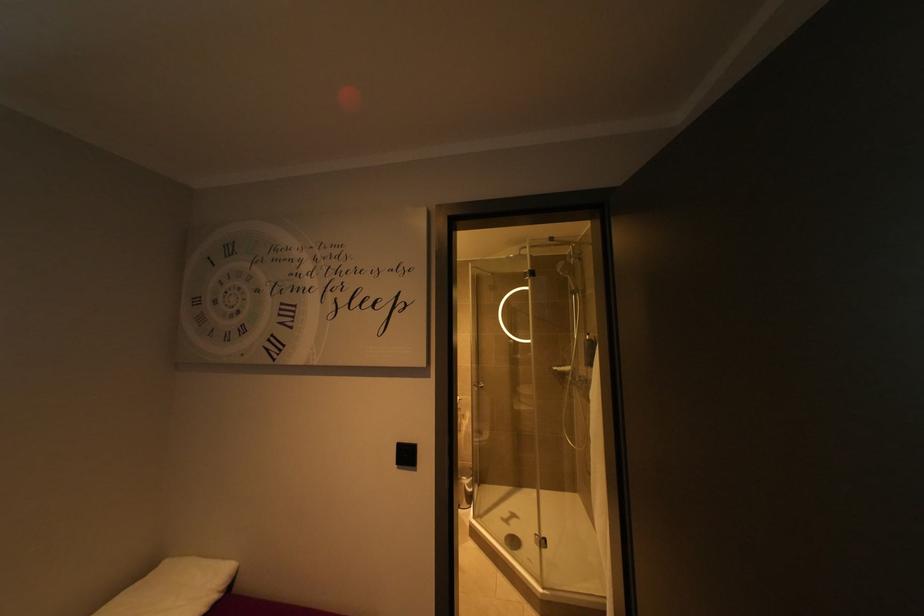
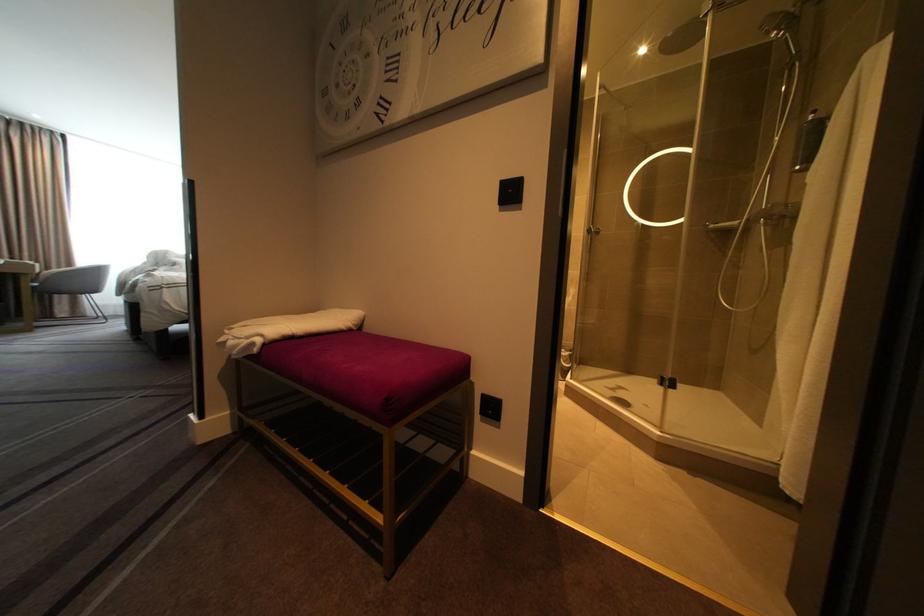
Which direction would the cameraman need to move to produce the second image?

The cameraman walked toward left, forward.